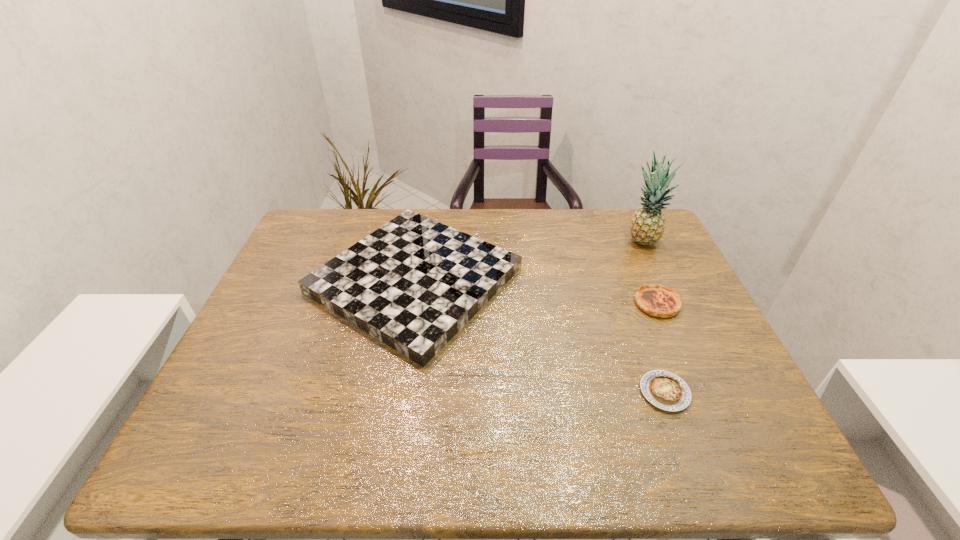
Locate an element on the screen. the tallest object is located at coordinates (647, 226).

At what (x,y) coordinates should I click in order to perform the action: click on checkerboard. Please return your answer as a coordinate pair (x, y). Looking at the image, I should click on (414, 283).

Locate an element on the screen. the leftmost object is located at coordinates (414, 283).

The height and width of the screenshot is (540, 960). Identify the location of the second shortest object. (662, 301).

Where is `the farther quiche`? the farther quiche is located at coordinates 662,301.

At what (x,y) coordinates should I click in order to perform the action: click on the nearest object. Please return your answer as a coordinate pair (x, y). Looking at the image, I should click on (665, 390).

You are a GUI agent. You are given a task and a screenshot of the screen. Output one action in this format:
    pyautogui.click(x=<x>, y=<y>)
    Task: Click on the shortest object
    
    Given the screenshot: What is the action you would take?
    pyautogui.click(x=665, y=390)

This screenshot has width=960, height=540. What are the coordinates of `vacant area situated 0.300m on the left of the pineapple` in the screenshot? It's located at pos(528,240).

At what (x,y) coordinates should I click in order to perform the action: click on vacant space located 0.190m on the front of the third shortest object. Please return your answer as a coordinate pair (x, y). Image resolution: width=960 pixels, height=540 pixels. Looking at the image, I should click on (388, 446).

Where is `vacant space located 0.180m on the back of the farther quiche`? This screenshot has width=960, height=540. vacant space located 0.180m on the back of the farther quiche is located at coordinates (634, 249).